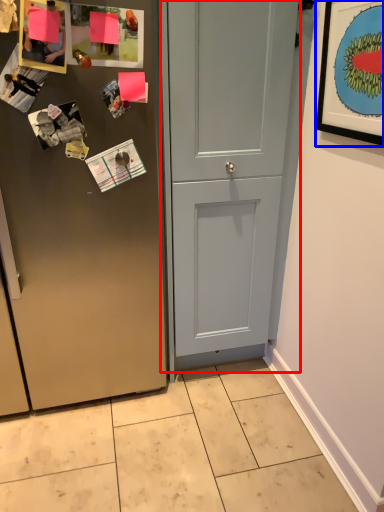
Question: Which object is closer to the camera taking this photo, door (highlighted by a red box) or picture frame (highlighted by a blue box)?

Choices:
 (A) door
 (B) picture frame

Answer: (B)